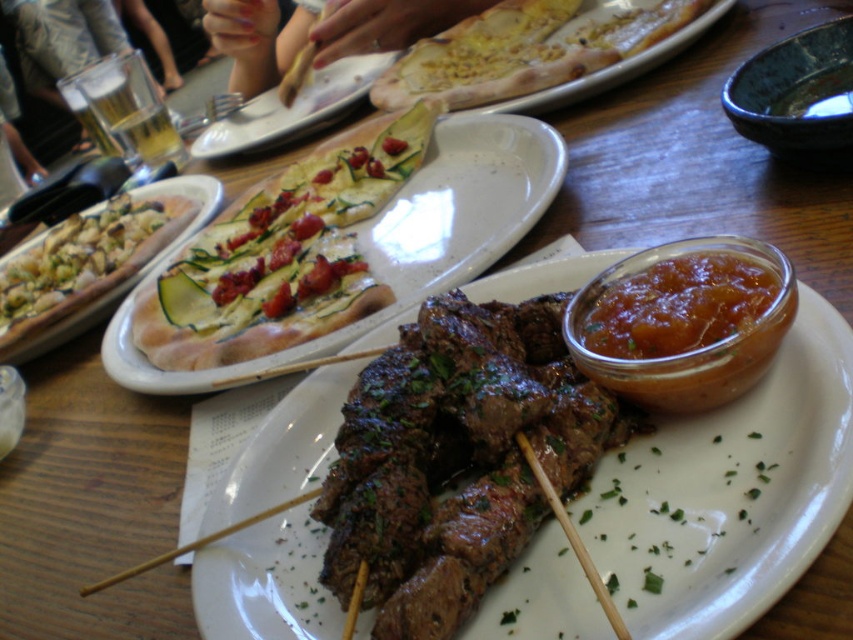
Question: Is golden brown crusty pizza at center to the left of shiny amber jam at center right from the viewer's perspective?

Choices:
 (A) no
 (B) yes

Answer: (B)

Question: Which object appears farthest from the camera in this image?

Choices:
 (A) matte ceramic plate at upper center
 (B) golden crusty pizza at upper center

Answer: (A)

Question: Does golden brown crusty pizza at center lie in front of white ceramic platter at upper center?

Choices:
 (A) no
 (B) yes

Answer: (B)

Question: Does golden crusty pizza at upper center have a larger size compared to matte ceramic plate at upper center?

Choices:
 (A) yes
 (B) no

Answer: (B)

Question: Considering the real-world distances, which object is farthest from the golden brown crusty pizza at center?

Choices:
 (A) shiny amber jam at center right
 (B) matte ceramic plate at upper center
 (C) white ceramic platter at upper center
 (D) green zucchini pizza at left

Answer: (B)

Question: Which point is farther from the camera taking this photo?

Choices:
 (A) (753, 246)
 (B) (483, 266)

Answer: (B)